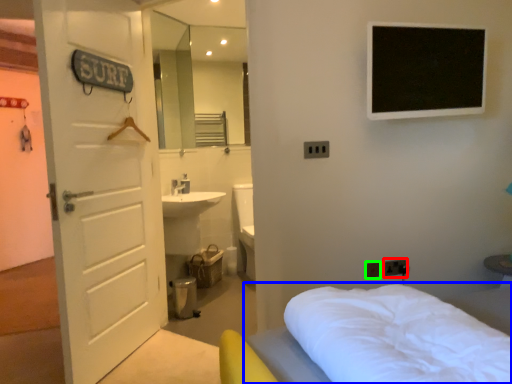
Question: Which is farther away from electric outlet (highlighted by a red box)? bed (highlighted by a blue box) or electric outlet (highlighted by a green box)?

Choices:
 (A) bed
 (B) electric outlet

Answer: (A)